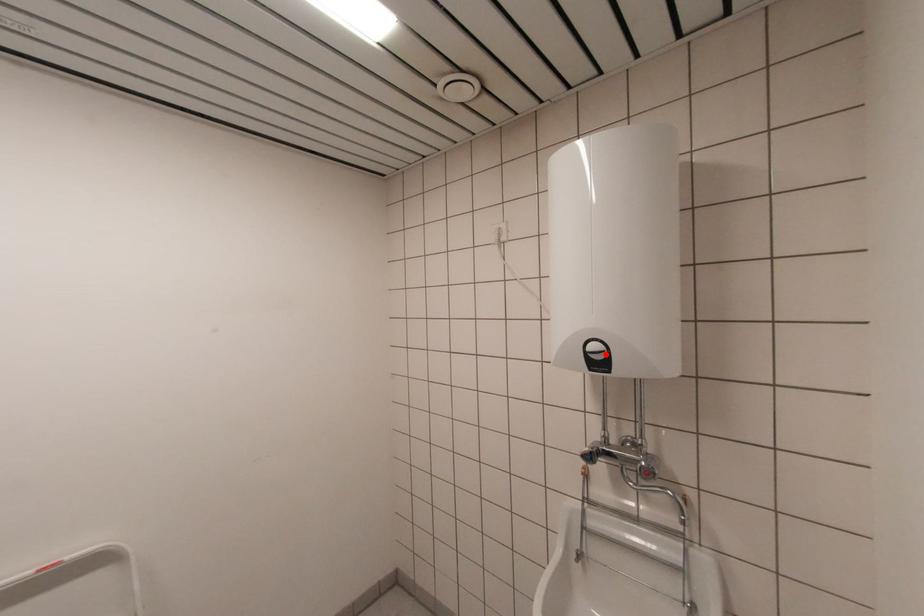
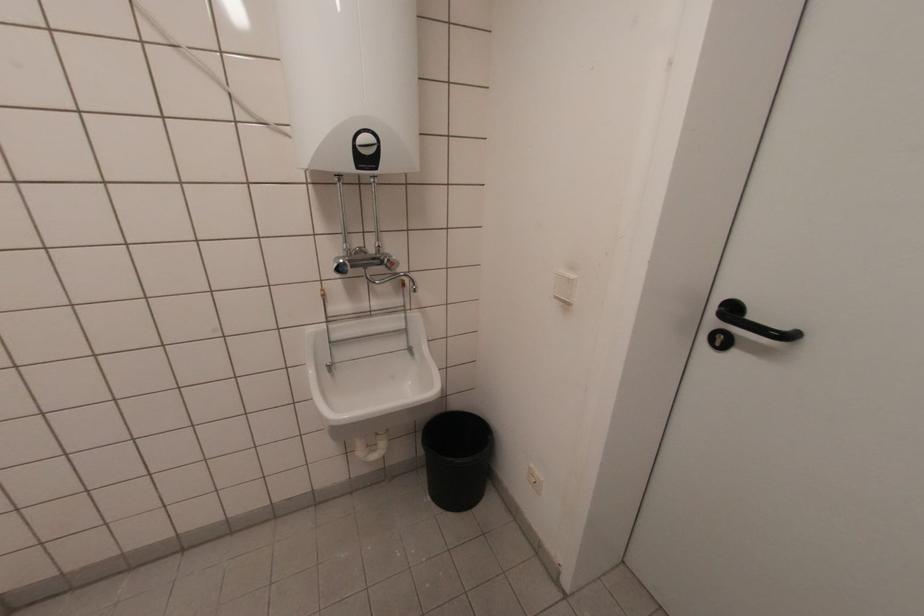
Locate, in the second image, the point that corresponds to the highlighted location in the first image.

(377, 148)